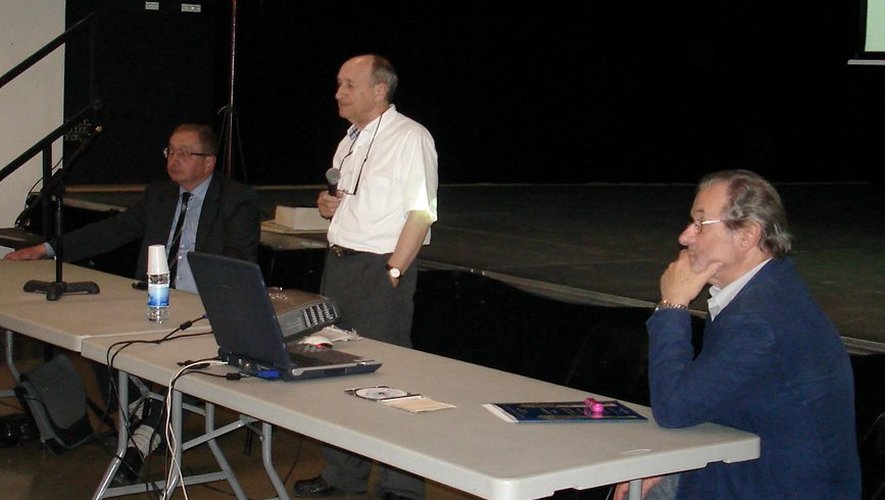
Find the location of a particular element. stage is located at coordinates (563, 219).